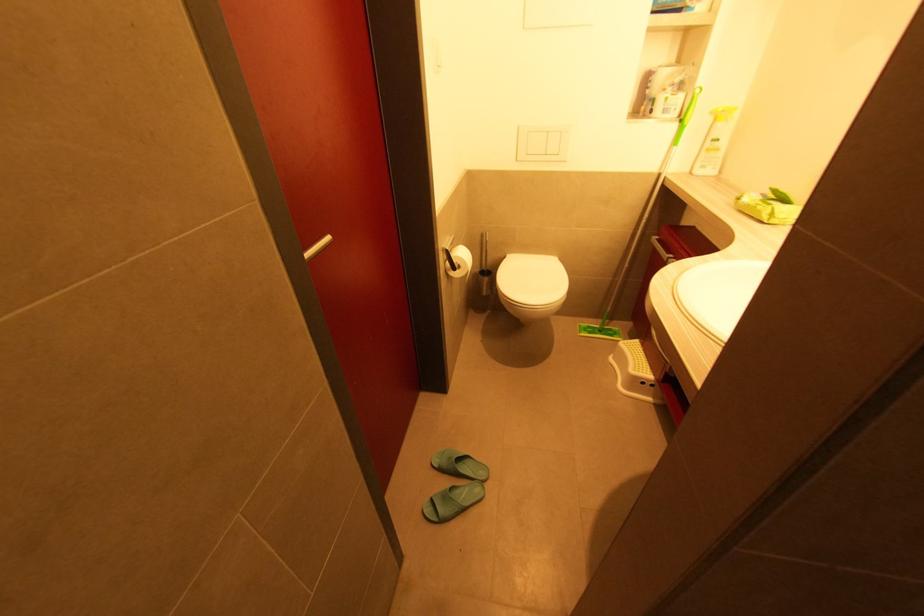
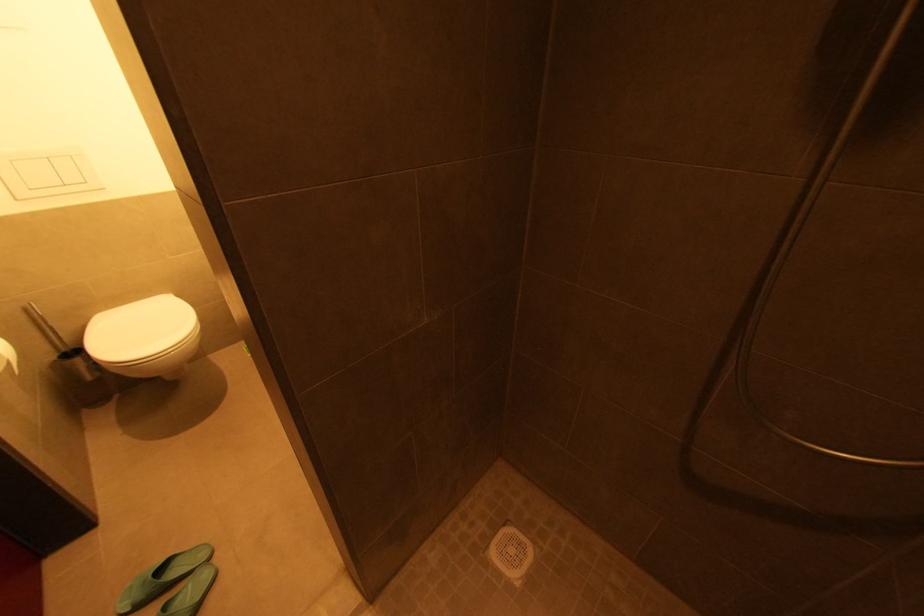
Question: The first image is from the beginning of the video and the second image is from the end. How did the camera likely rotate when shooting the video?

Choices:
 (A) Left
 (B) Right
 (C) Up
 (D) Down

Answer: (B)